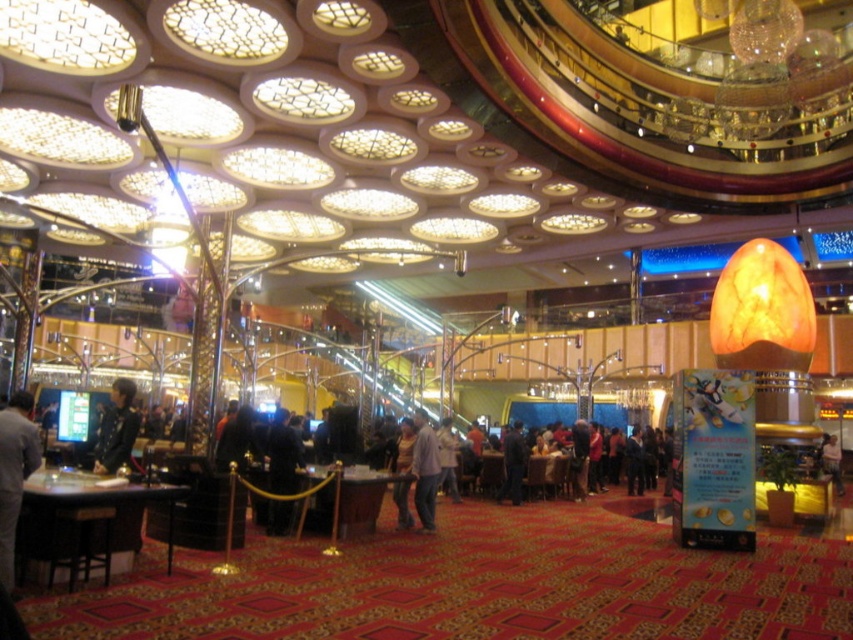
Between point (13, 467) and point (422, 429), which one is positioned in front?

Positioned in front is point (13, 467).

Which is behind, point (15, 525) or point (422, 502)?

Positioned behind is point (422, 502).

Which is behind, point (3, 449) or point (430, 467)?

Point (430, 467)

The height and width of the screenshot is (640, 853). I want to click on gray fabric jacket at lower left, so click(x=15, y=474).

Can you confirm if gray fabric jacket at lower left is wider than dark blue jacket at left?

Incorrect, gray fabric jacket at lower left's width does not surpass dark blue jacket at left's.

Who is more forward, (x=26, y=451) or (x=112, y=460)?

Positioned in front is point (x=26, y=451).

Is point (21, 435) positioned after point (131, 388)?

No, it is not.

What are the coordinates of `gray fabric jacket at lower left` in the screenshot? It's located at (15, 474).

Is dark blue fabric jacket at center thinner than light brown leather jacket at center?

Yes, dark blue fabric jacket at center is thinner than light brown leather jacket at center.

Does dark blue fabric jacket at center appear on the left side of light brown leather jacket at center?

Yes, dark blue fabric jacket at center is to the left of light brown leather jacket at center.

This screenshot has height=640, width=853. Find the location of `dark blue fabric jacket at center`. dark blue fabric jacket at center is located at coordinates (283, 452).

Identify the location of dark blue fabric jacket at center. (283, 452).